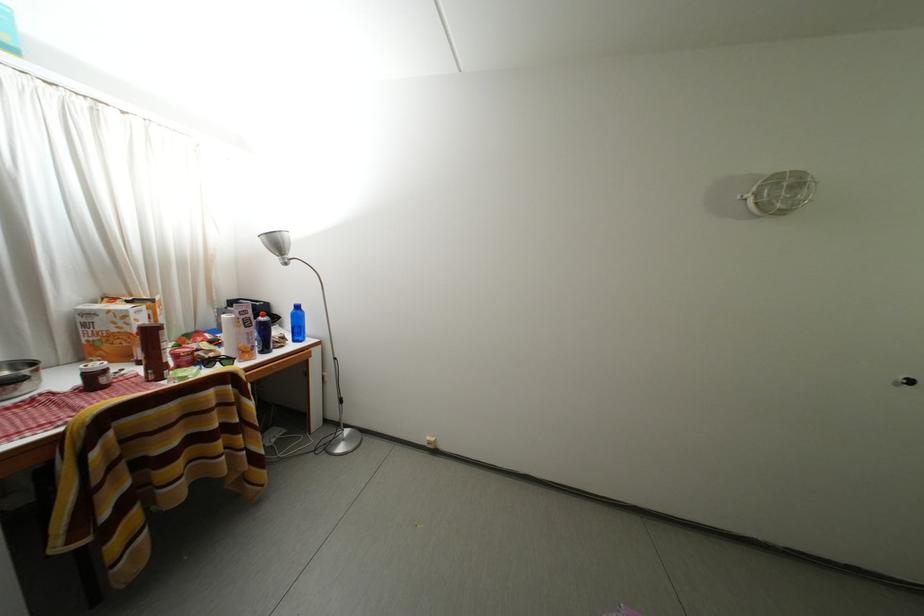
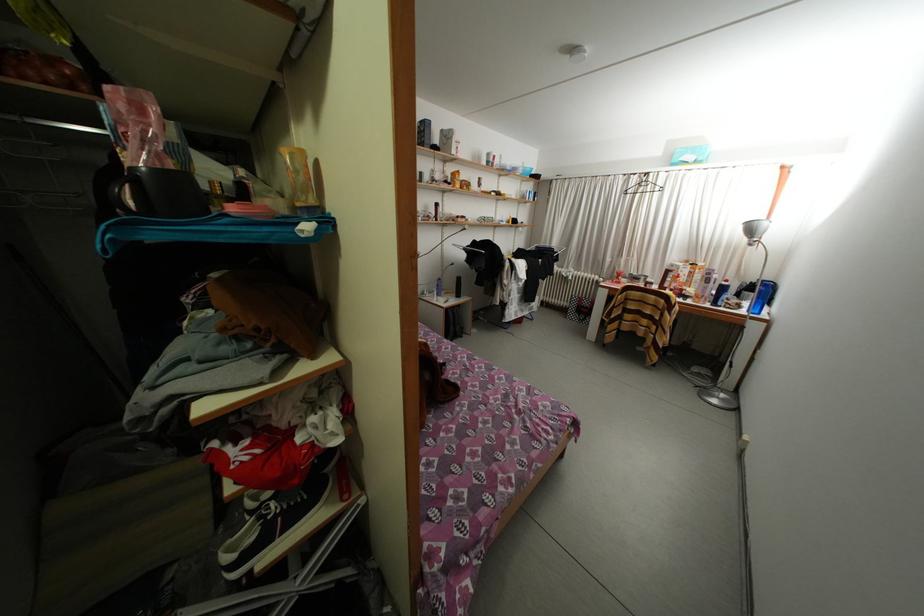
Where in the second image is the point corresponding to point (292, 344) from the first image?

(747, 310)